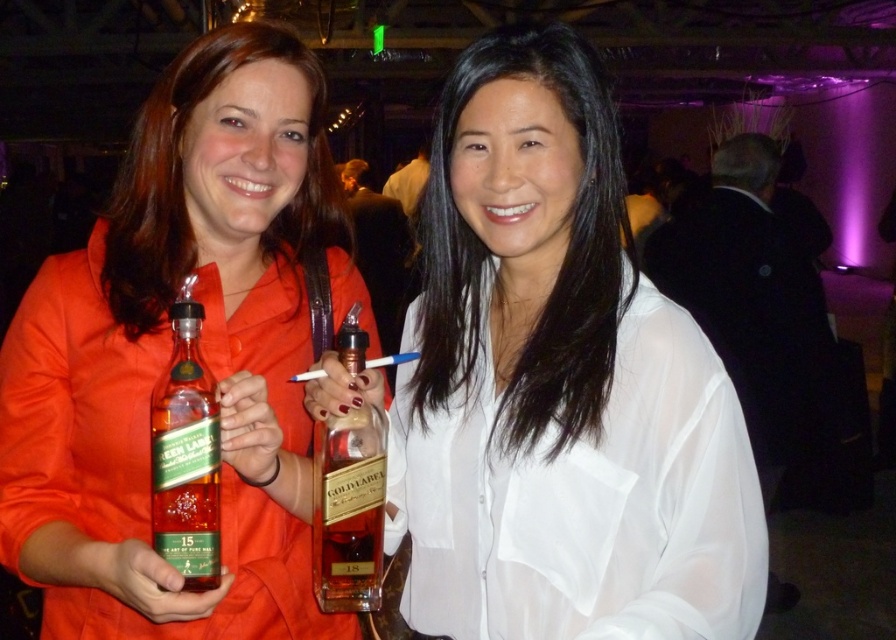
Question: From the image, what is the correct spatial relationship of matte glass bottle at center in relation to goldmaterial/texture bottle at center?

Choices:
 (A) right
 (B) left

Answer: (B)

Question: Which point is closer to the camera taking this photo?

Choices:
 (A) (214, 515)
 (B) (533, 198)

Answer: (A)

Question: Among these points, which one is nearest to the camera?

Choices:
 (A) (233, 611)
 (B) (538, 147)
 (C) (341, 513)
 (D) (162, 554)

Answer: (D)

Question: Does green glass bottle at center come behind goldmaterial/texture bottle at center?

Choices:
 (A) yes
 (B) no

Answer: (B)

Question: Considering the relative positions of white sheer shirt at center and goldmaterial/texture bottle at center in the image provided, where is white sheer shirt at center located with respect to goldmaterial/texture bottle at center?

Choices:
 (A) left
 (B) right

Answer: (B)

Question: Which object is farther from the camera taking this photo?

Choices:
 (A) green glass bottle at center
 (B) matte glass bottle at center
 (C) white sheer shirt at center

Answer: (A)